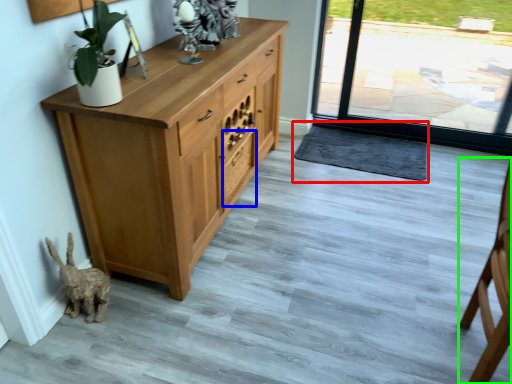
Question: Based on their relative distances, which object is nearer to doormat (highlighted by a red box)? Choose from drawer (highlighted by a blue box) and chair (highlighted by a green box).

Choices:
 (A) drawer
 (B) chair

Answer: (A)